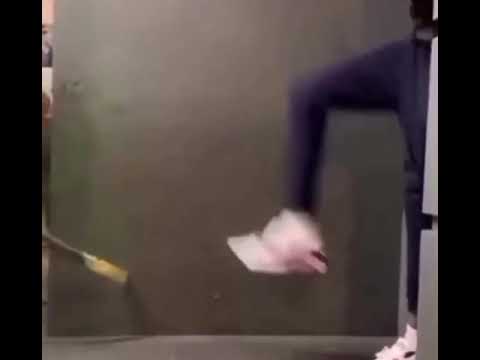
At what (x,y) coordinates should I click in order to perform the action: click on wall. Please return your answer as a coordinate pair (x, y). Looking at the image, I should click on (205, 189).